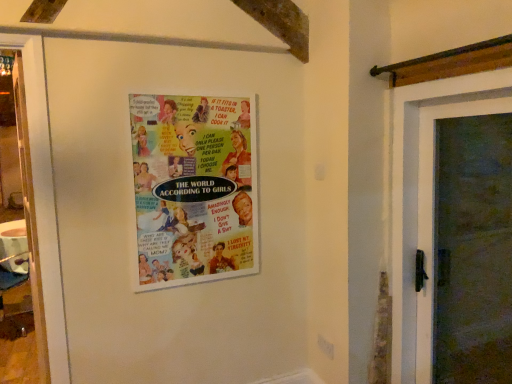
Question: Is wooden door at right inside the boundaries of multicolored paper poster at center, or outside?

Choices:
 (A) inside
 (B) outside

Answer: (B)

Question: Based on their positions, is wooden door at right located to the left or right of multicolored paper poster at center?

Choices:
 (A) right
 (B) left

Answer: (A)

Question: Looking at the image, does wooden door at right seem bigger or smaller compared to multicolored paper poster at center?

Choices:
 (A) big
 (B) small

Answer: (A)

Question: From the image's perspective, relative to wooden door at right, is multicolored paper poster at center above or below?

Choices:
 (A) below
 (B) above

Answer: (B)

Question: In the image, is multicolored paper poster at center positioned in front of or behind wooden door at right?

Choices:
 (A) front
 (B) behind

Answer: (B)

Question: From their relative heights in the image, would you say multicolored paper poster at center is taller or shorter than wooden door at right?

Choices:
 (A) short
 (B) tall

Answer: (A)

Question: Looking at the image, does multicolored paper poster at center seem bigger or smaller compared to wooden door at right?

Choices:
 (A) big
 (B) small

Answer: (B)